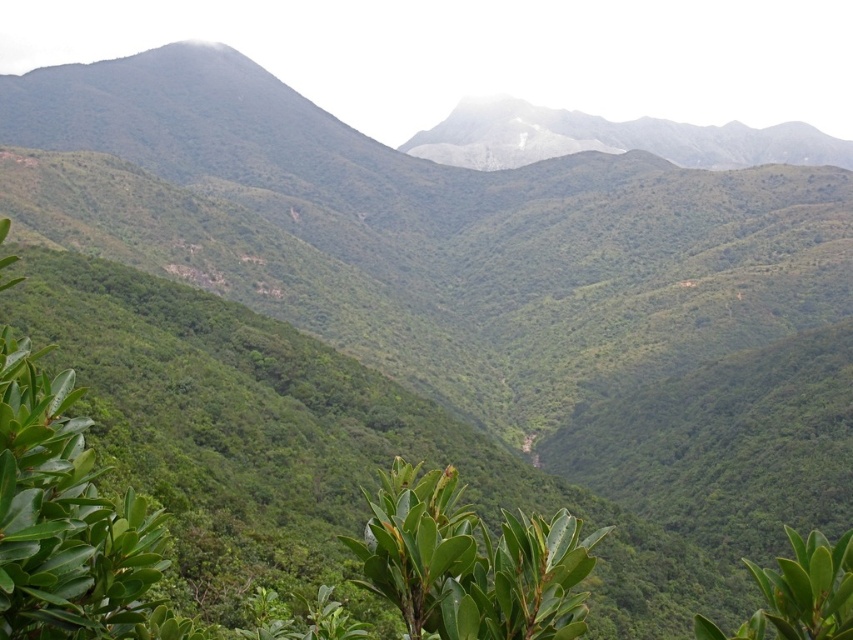
Is gray/smooth mountain at upper center taller than green leafy tree at lower right?

Yes, gray/smooth mountain at upper center is taller than green leafy tree at lower right.

Between gray/smooth mountain at upper center and green leafy tree at lower right, which one has more height?

gray/smooth mountain at upper center

Describe the element at coordinates (612, 138) in the screenshot. I see `gray/smooth mountain at upper center` at that location.

The image size is (853, 640). I want to click on gray/smooth mountain at upper center, so click(612, 138).

Who is positioned more to the right, green leafy shrub at left or green leafy plant at center?

green leafy plant at center is more to the right.

Is green leafy shrub at left below green leafy plant at center?

No, green leafy shrub at left is not below green leafy plant at center.

Does point (155, 516) come in front of point (413, 593)?

No, it is behind (413, 593).

Find the location of a particular element. green leafy shrub at left is located at coordinates (67, 522).

Is green leafy shrub at left to the right of green leafy tree at lower right from the viewer's perspective?

No, green leafy shrub at left is not to the right of green leafy tree at lower right.

Is point (65, 477) closer to camera compared to point (842, 628)?

That is False.

Identify the location of green leafy shrub at left. This screenshot has height=640, width=853. click(x=67, y=522).